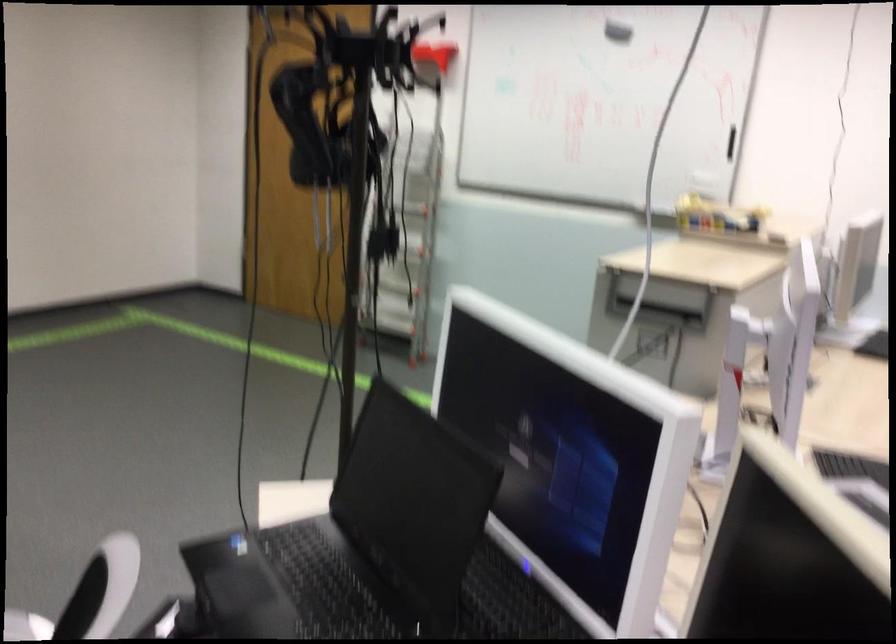
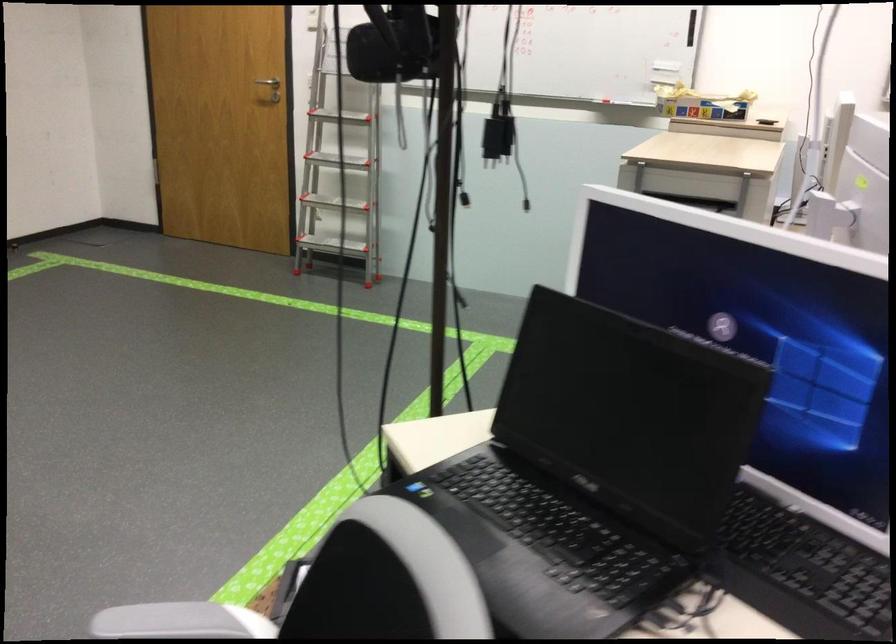
Question: The camera is either moving clockwise (left) or counter-clockwise (right) around the object. The first image is from the beginning of the video and the second image is from the end. Is the camera moving left or right when shooting the video?

Choices:
 (A) Left
 (B) Right

Answer: (A)